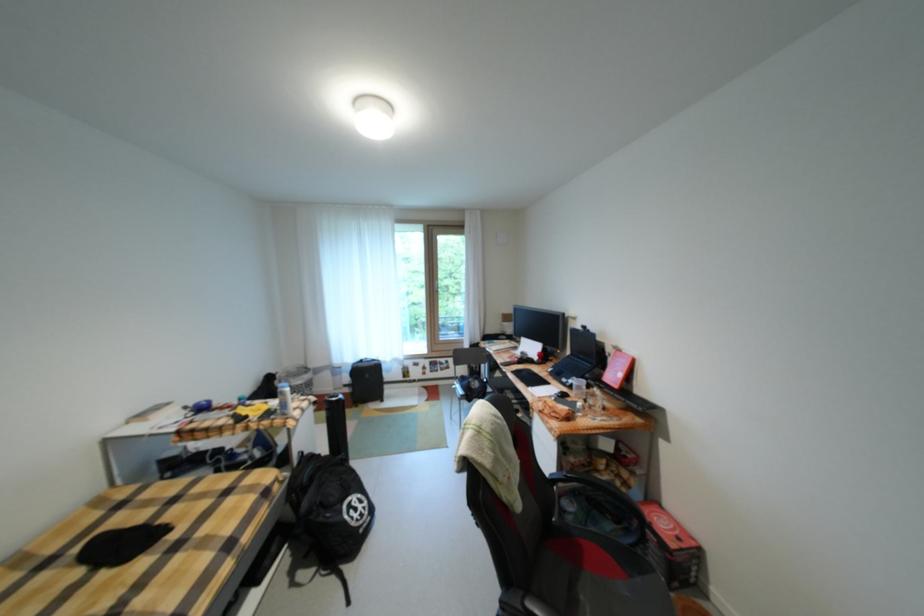
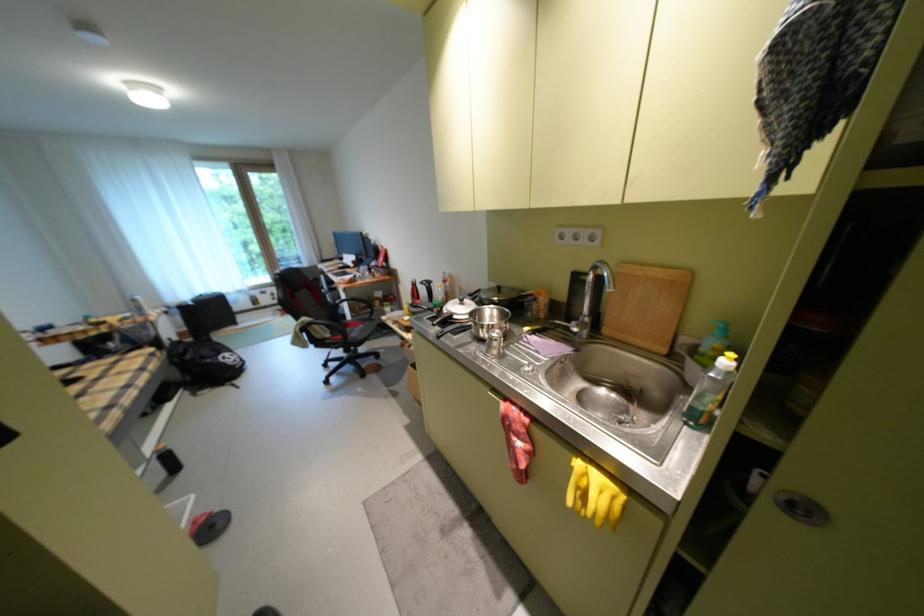
The point at (368, 506) is marked in the first image. Where is the corresponding point in the second image?

(239, 358)